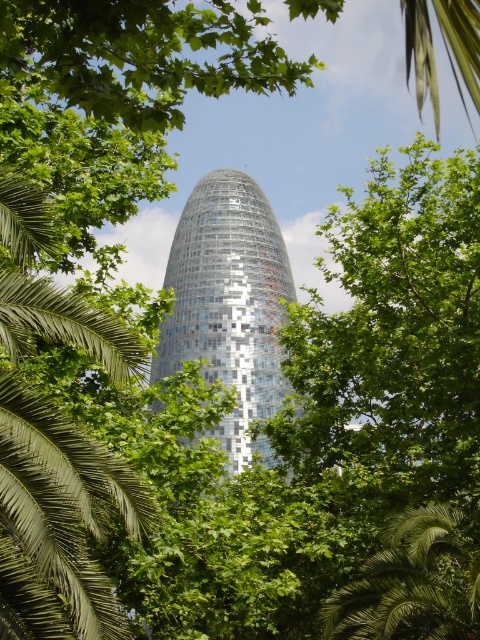
Is shiny glass tower at center smaller than green leafy palm tree at lower right?

Incorrect, shiny glass tower at center is not smaller in size than green leafy palm tree at lower right.

Between shiny glass tower at center and green leafy palm tree at lower right, which one appears on the left side from the viewer's perspective?

shiny glass tower at center is more to the left.

Describe the element at coordinates (228, 301) in the screenshot. Image resolution: width=480 pixels, height=640 pixels. I see `shiny glass tower at center` at that location.

The width and height of the screenshot is (480, 640). Identify the location of shiny glass tower at center. (228, 301).

Can you confirm if green leafy palm tree at left is positioned to the right of shiny glass tower at center?

In fact, green leafy palm tree at left is to the left of shiny glass tower at center.

In order to click on green leafy palm tree at left in this screenshot , I will do `click(57, 518)`.

Measure the distance between green leafy palm tree at left and camera.

green leafy palm tree at left is 270.33 feet away from camera.

Who is positioned more to the left, green leafy palm tree at left or green leafy palm tree at lower right?

green leafy palm tree at left is more to the left.

Identify the location of green leafy palm tree at left. The image size is (480, 640). (57, 518).